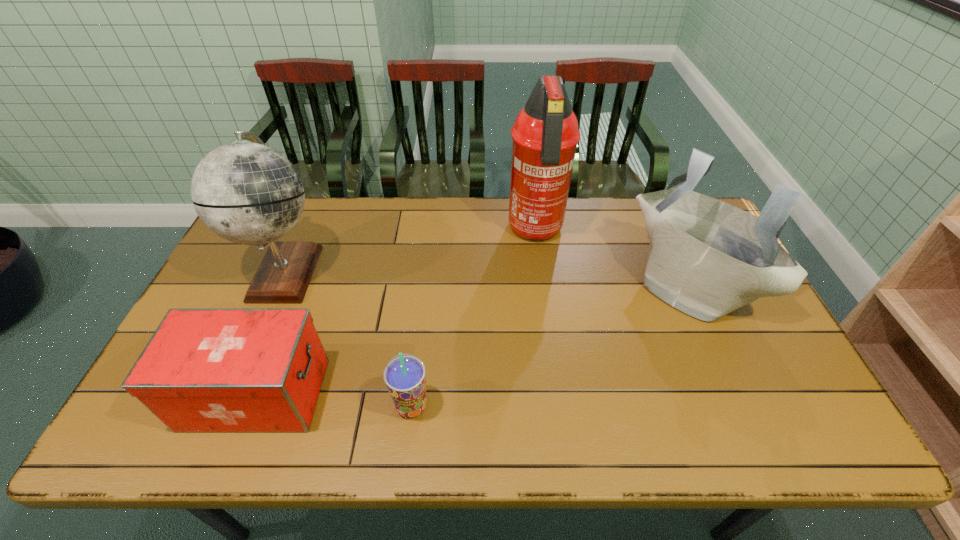
At what (x,y) coordinates should I click in order to perform the action: click on free spot that satisfies the following two spatial constraints: 1. on the trigger side of the fourth object from left to right; 2. on the handle side of the first-aid kit. Please return your answer as a coordinate pair (x, y). Looking at the image, I should click on (558, 394).

Find the location of a particular element. The width and height of the screenshot is (960, 540). vacant space that satisfies the following two spatial constraints: 1. on the front side of the rightmost object; 2. on the handle side of the first-aid kit is located at coordinates (737, 394).